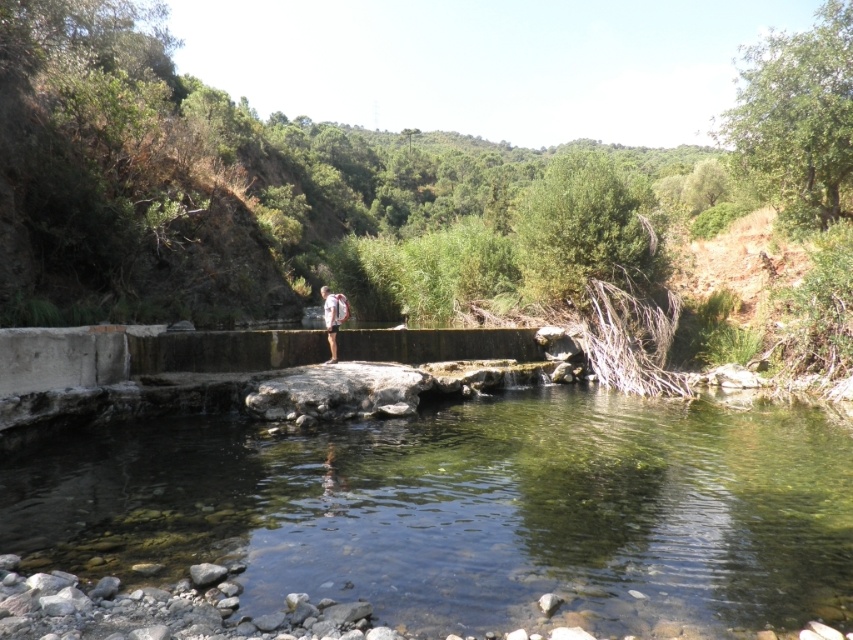
Question: Is clear water at center further to camera compared to light brown fabric shorts at center?

Choices:
 (A) yes
 (B) no

Answer: (B)

Question: Does clear water at center have a smaller size compared to light brown fabric shorts at center?

Choices:
 (A) no
 (B) yes

Answer: (A)

Question: Which object is farther from the camera taking this photo?

Choices:
 (A) light brown fabric shorts at center
 (B) clear water at center

Answer: (A)

Question: Can you confirm if clear water at center is positioned above light brown fabric shorts at center?

Choices:
 (A) yes
 (B) no

Answer: (B)